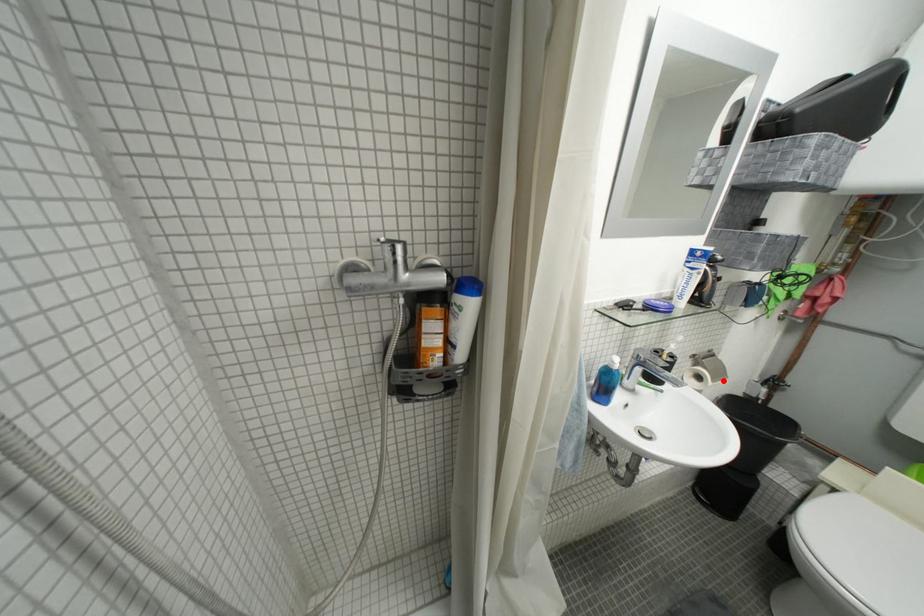
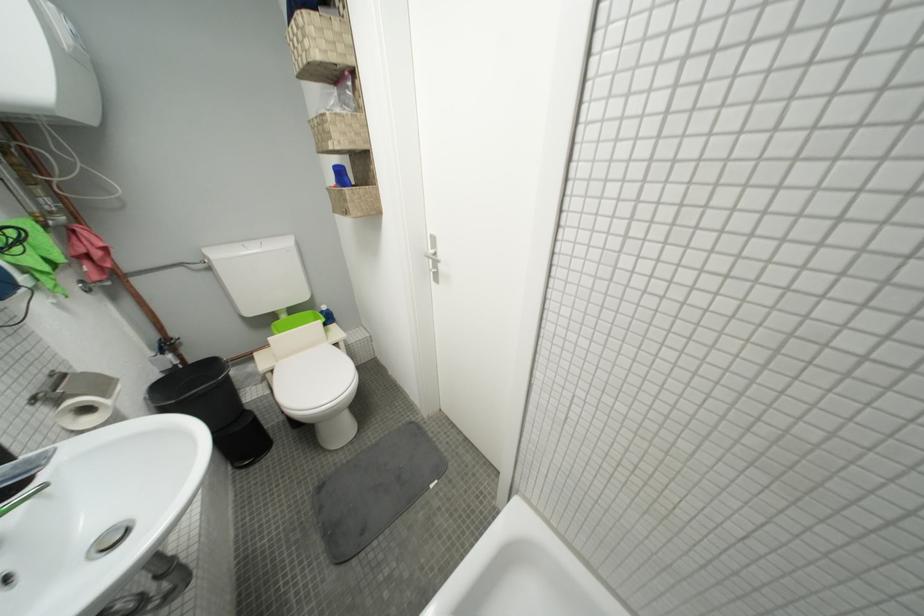
The point at the highlighted location is marked in the first image. Where is the corresponding point in the second image?

(113, 397)